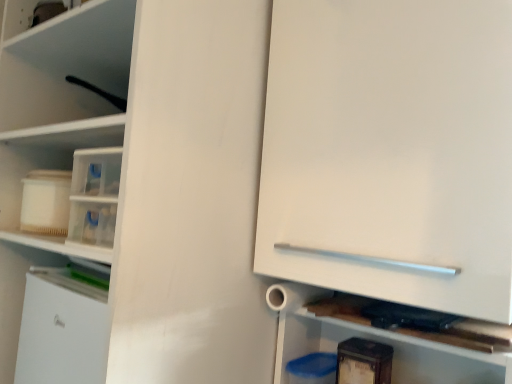
Question: Considering the relative sizes of white glossy cabinet at center and wooden cutting board at lower right in the image provided, is white glossy cabinet at center smaller than wooden cutting board at lower right?

Choices:
 (A) yes
 (B) no

Answer: (B)

Question: Does white glossy cabinet at center lie in front of wooden cutting board at lower right?

Choices:
 (A) yes
 (B) no

Answer: (A)

Question: Considering the relative positions of white glossy cabinet at center and wooden cutting board at lower right in the image provided, is white glossy cabinet at center to the left of wooden cutting board at lower right from the viewer's perspective?

Choices:
 (A) yes
 (B) no

Answer: (B)

Question: Is white glossy cabinet at center further to camera compared to wooden cutting board at lower right?

Choices:
 (A) yes
 (B) no

Answer: (B)

Question: From a real-world perspective, does white glossy cabinet at center sit lower than wooden cutting board at lower right?

Choices:
 (A) no
 (B) yes

Answer: (A)

Question: Can you confirm if white glossy cabinet at center is taller than wooden cutting board at lower right?

Choices:
 (A) no
 (B) yes

Answer: (B)

Question: Is wooden cutting board at lower right behind white glossy cabinet at center?

Choices:
 (A) no
 (B) yes

Answer: (B)

Question: Is wooden cutting board at lower right located outside white glossy cabinet at center?

Choices:
 (A) yes
 (B) no

Answer: (A)

Question: Does wooden cutting board at lower right lie in front of white glossy cabinet at center?

Choices:
 (A) no
 (B) yes

Answer: (A)

Question: Can you confirm if wooden cutting board at lower right is positioned to the left of white glossy cabinet at center?

Choices:
 (A) yes
 (B) no

Answer: (A)

Question: Does wooden cutting board at lower right have a lesser height compared to white glossy cabinet at center?

Choices:
 (A) no
 (B) yes

Answer: (B)

Question: From the image's perspective, is wooden cutting board at lower right under white glossy cabinet at center?

Choices:
 (A) yes
 (B) no

Answer: (A)

Question: From their relative heights in the image, would you say white glossy cabinet at center is taller or shorter than wooden cutting board at lower right?

Choices:
 (A) tall
 (B) short

Answer: (A)